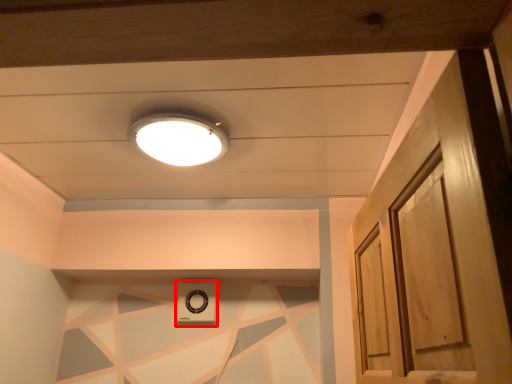
Question: From the image's perspective, where is appliance (annotated by the red box) located relative to lamp?

Choices:
 (A) below
 (B) above

Answer: (A)